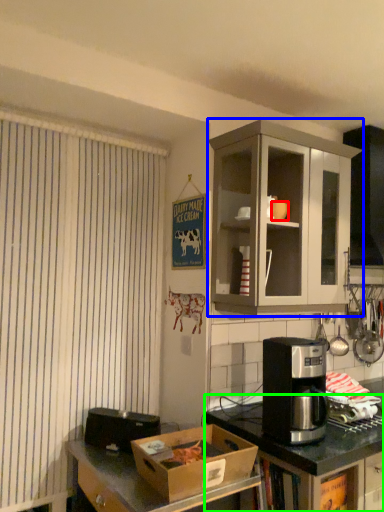
Question: Estimate the real-world distances between objects in this image. Which object is closer to coffee cup (highlighted by a red box), cabinetry (highlighted by a blue box) or counter (highlighted by a green box)?

Choices:
 (A) cabinetry
 (B) counter

Answer: (A)